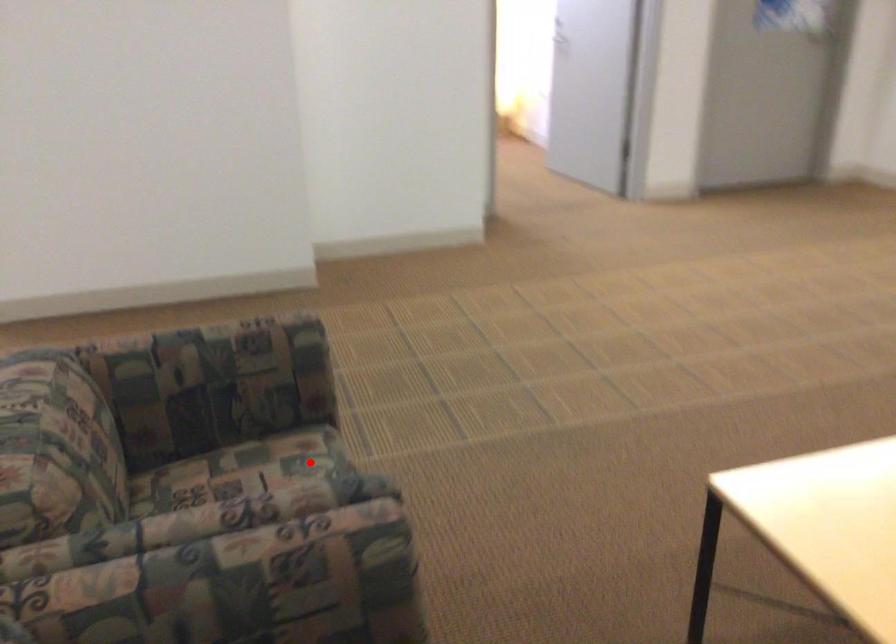
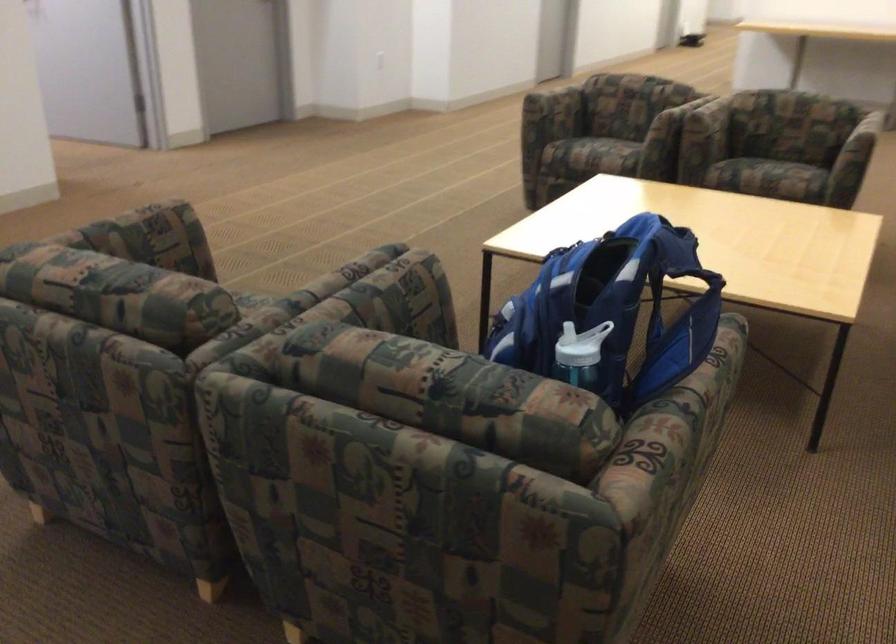
Question: I am providing you with two images of the same scene from different viewpoints. Given a red point in image1, look at the same physical point in image2. Is it:

Choices:
 (A) Closer to the viewpoint
 (B) Farther from the viewpoint

Answer: (B)